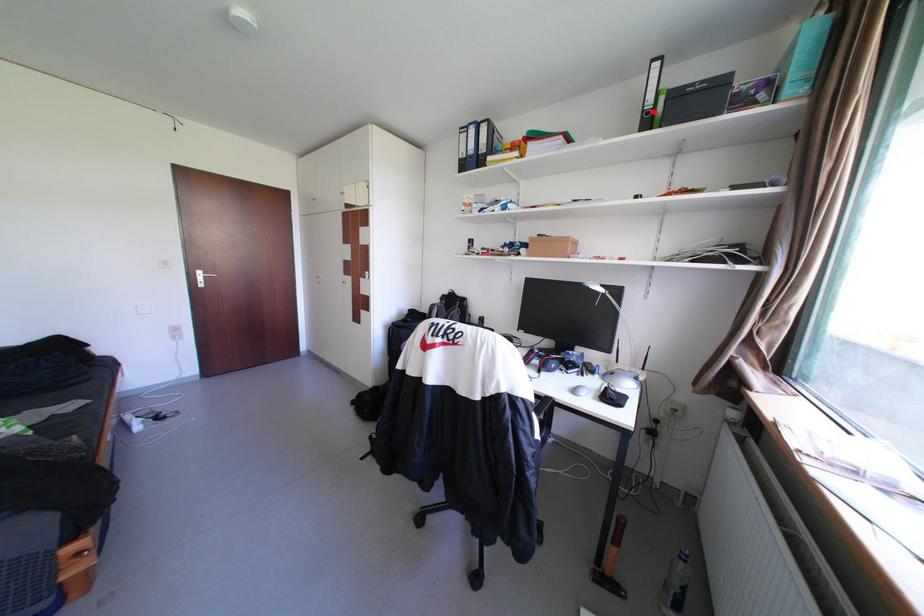
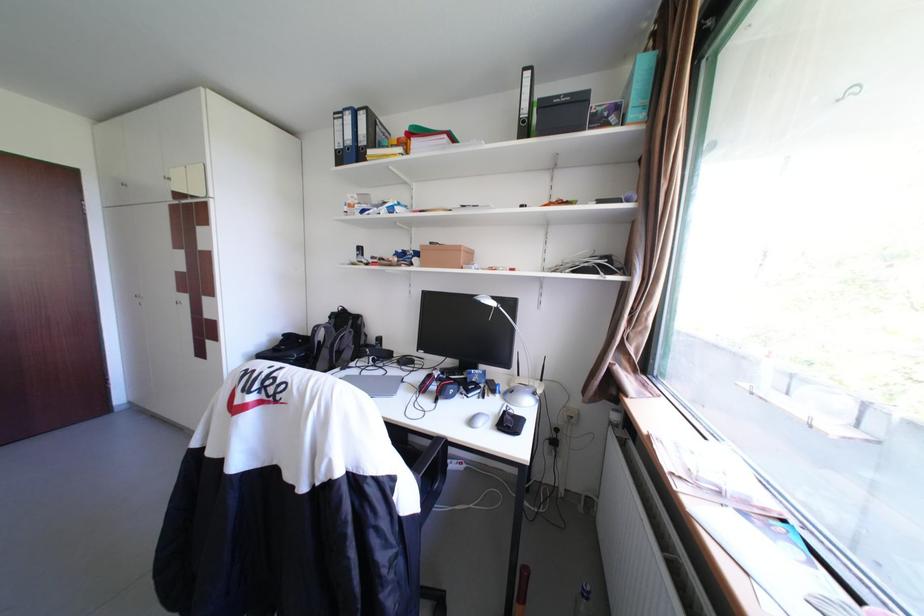
Where in the second image is the point corresponding to the highlighted location from the first image?

(530, 120)